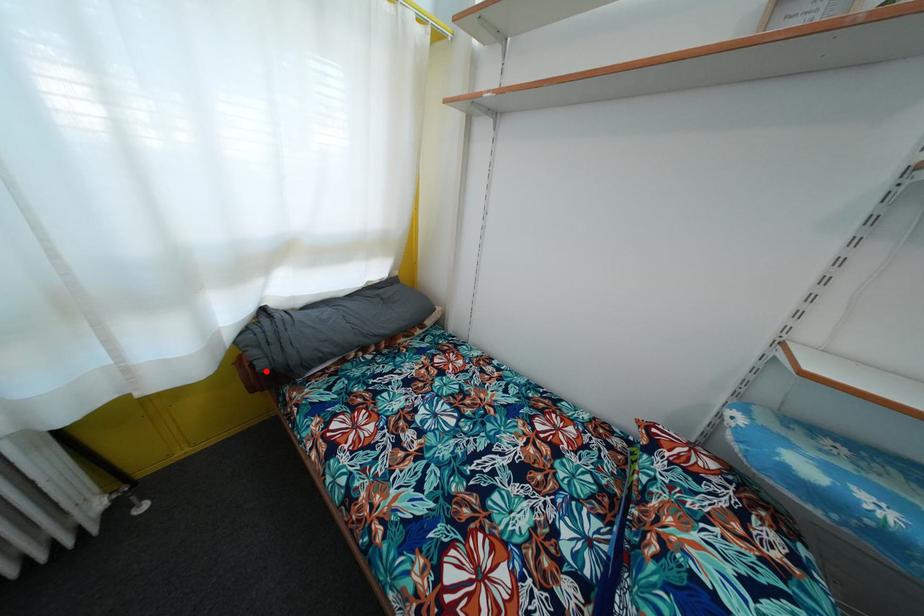
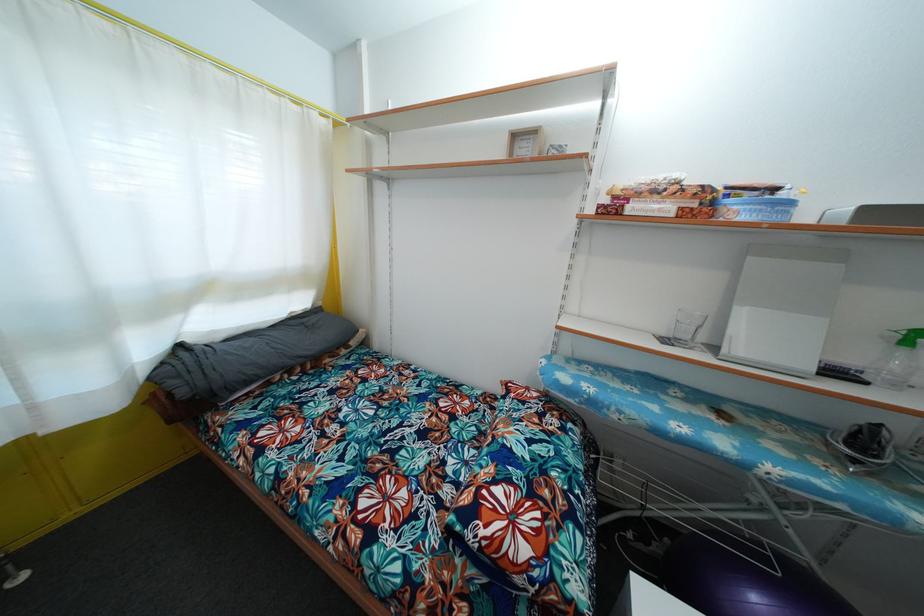
Question: I am providing you with two images of the same scene from different viewpoints. A red point is shown in image1. For the corresponding object point in image2, is it positioned nearer or farther from the camera?

Choices:
 (A) Nearer
 (B) Farther

Answer: (A)